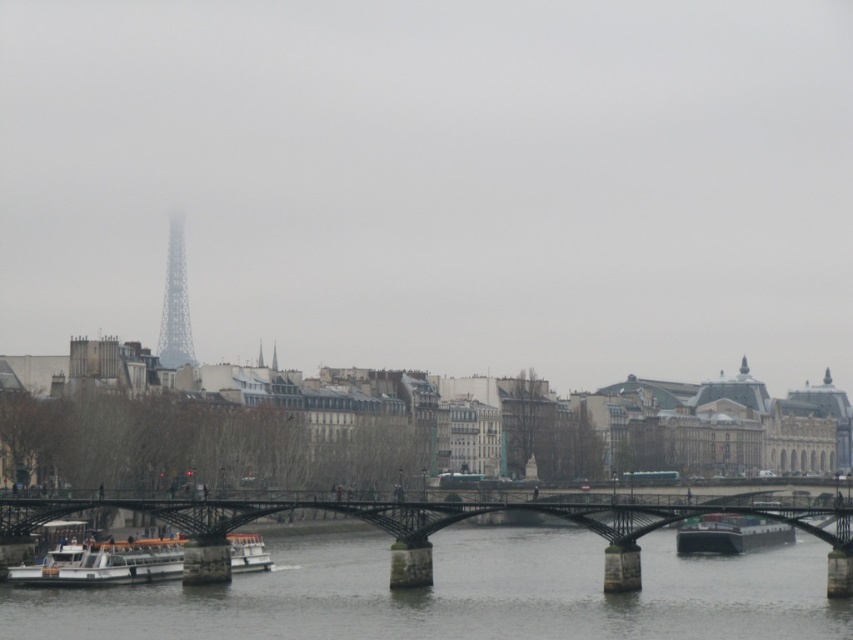
Question: Where is metallic bridge at center located in relation to white matte boat at center in the image?

Choices:
 (A) left
 (B) right

Answer: (B)

Question: Considering the real-world distances, which object is farthest from the metallic bridge at center?

Choices:
 (A) white matte boat at center
 (B) green matte barge at lower right
 (C) white matte boat at lower left
 (D) metallic gray tower at upper left

Answer: (D)

Question: Where is white matte boat at lower left located in relation to green matte barge at lower right in the image?

Choices:
 (A) right
 (B) left

Answer: (B)

Question: Based on their relative distances, which object is nearer to the white matte boat at lower left?

Choices:
 (A) green matte barge at lower right
 (B) white matte boat at center

Answer: (B)

Question: Which object is the closest to the metallic gray tower at upper left?

Choices:
 (A) metallic bridge at center
 (B) white matte boat at lower left
 (C) white matte boat at center

Answer: (B)

Question: Is metallic gray tower at upper left positioned at the back of white matte boat at center?

Choices:
 (A) no
 (B) yes

Answer: (B)